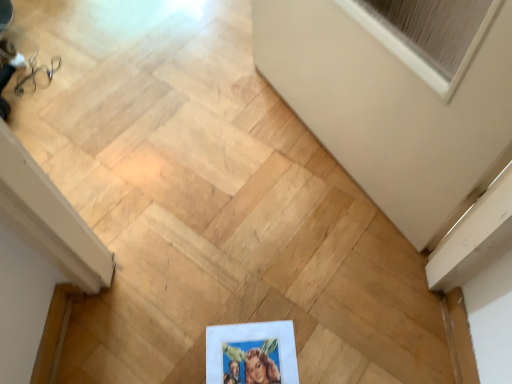
This screenshot has width=512, height=384. In order to click on white textured curtain at upper right in this screenshot , I will do `click(428, 34)`.

The height and width of the screenshot is (384, 512). What do you see at coordinates (428, 34) in the screenshot? I see `white textured curtain at upper right` at bounding box center [428, 34].

Where is `white textured curtain at upper right`? The image size is (512, 384). white textured curtain at upper right is located at coordinates (428, 34).